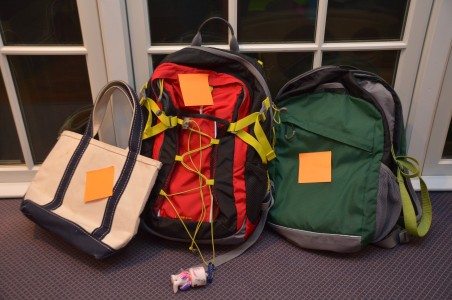
Image resolution: width=452 pixels, height=300 pixels. Find the location of `yellow sticky notes`. yellow sticky notes is located at coordinates (100, 181), (194, 90), (313, 155).